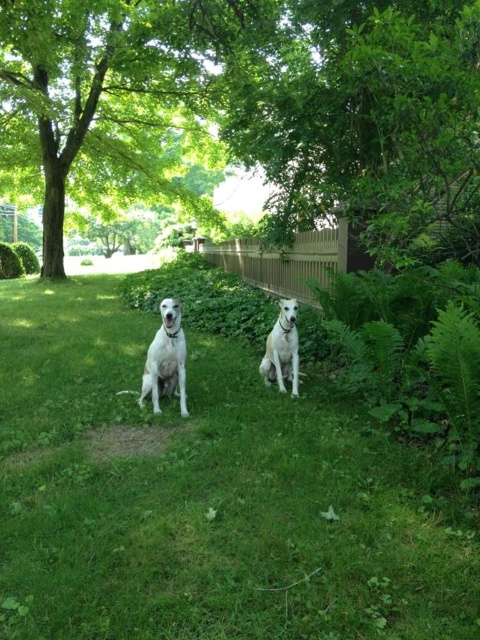
You are a photographer trying to capture both the green grass at center and the white glossy dog at center in a single frame. Based on their positions, which object should you adjust your camera to focus on first to ensure both are in the shot?

The green grass at center is to the left of the white glossy dog at center, so you should focus on the white glossy dog at center first to ensure both are included in the frame.